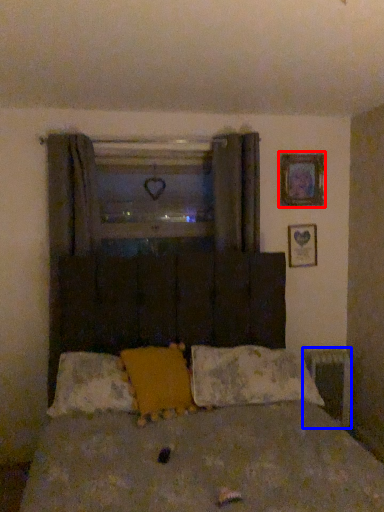
Question: Which of the following is the closest to the observer, picture frame (highlighted by a red box) or radiator (highlighted by a blue box)?

Choices:
 (A) picture frame
 (B) radiator

Answer: (A)